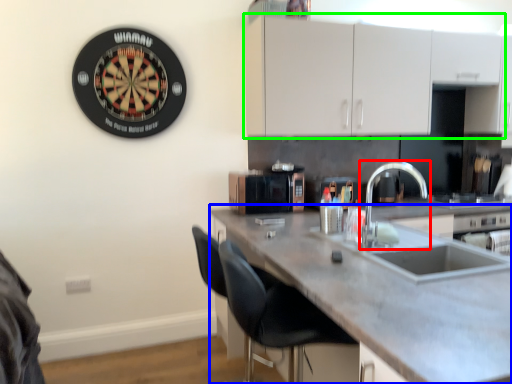
Question: Which is farther away from tap (highlighted by a red box)? countertop (highlighted by a blue box) or cabinetry (highlighted by a green box)?

Choices:
 (A) countertop
 (B) cabinetry

Answer: (A)